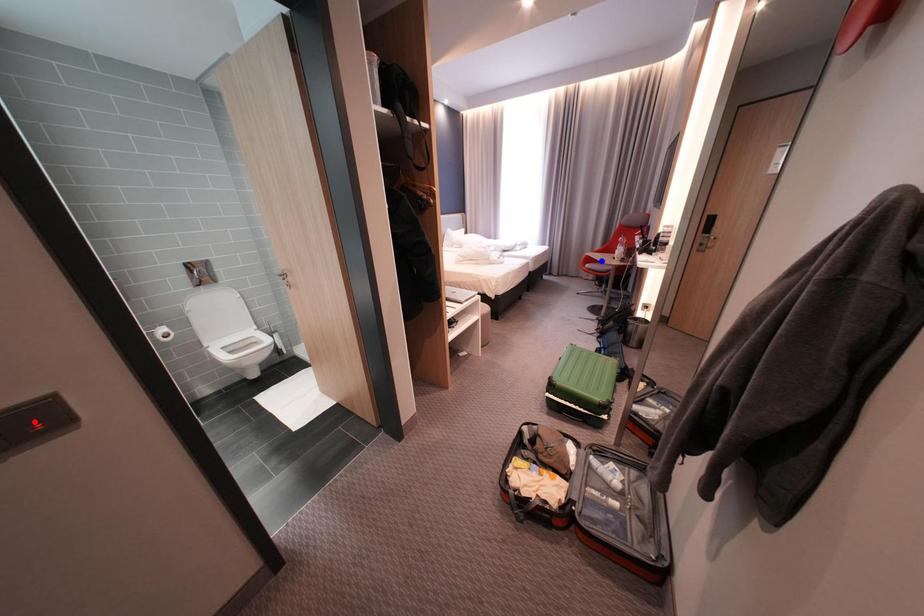
Question: Which of the two points in the image is closer to the camera?

Choices:
 (A) Blue point is closer.
 (B) Red point is closer.

Answer: (B)